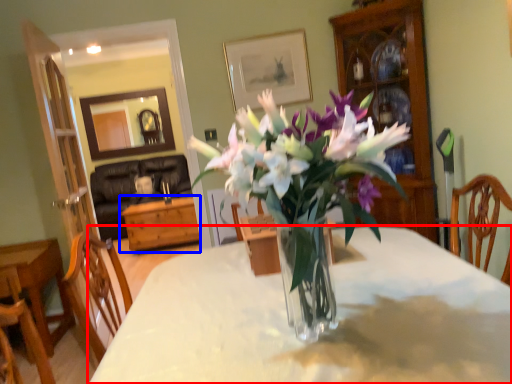
Question: Which of the following is the farthest to the observer, desk (highlighted by a red box) or table (highlighted by a blue box)?

Choices:
 (A) desk
 (B) table

Answer: (B)